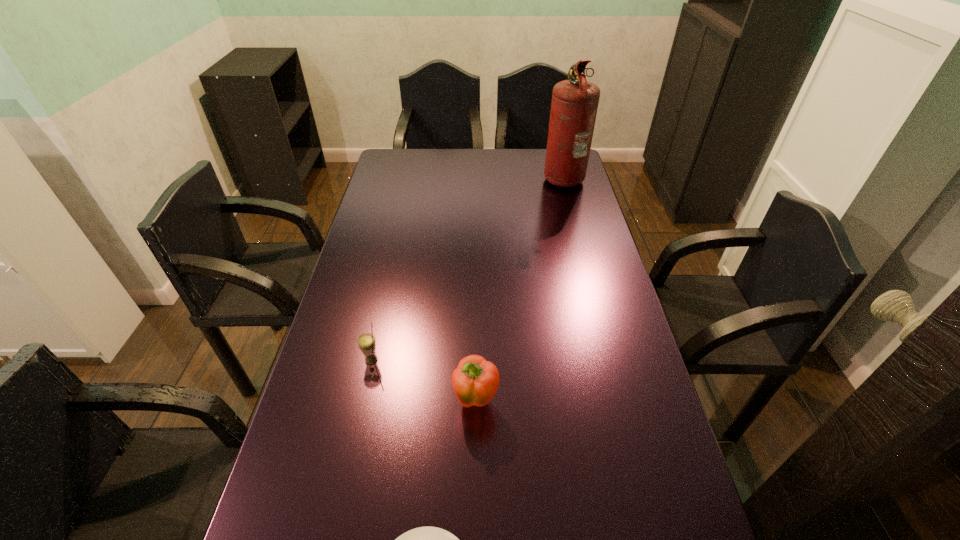
I want to click on free space located 0.310m on the right of the third tallest object, so click(501, 360).

Where is `object present at the far edge`? This screenshot has width=960, height=540. object present at the far edge is located at coordinates (574, 105).

At what (x,y) coordinates should I click in order to perform the action: click on object that is at the left edge. Please return your answer as a coordinate pair (x, y). Looking at the image, I should click on (366, 342).

Locate an element on the screen. This screenshot has width=960, height=540. object located at the right edge is located at coordinates (574, 105).

The width and height of the screenshot is (960, 540). Find the location of `object present at the far right corner`. object present at the far right corner is located at coordinates (574, 105).

Find the location of a particular element. free space at the far edge is located at coordinates (437, 159).

The width and height of the screenshot is (960, 540). Identify the location of free space at the left edge. (310, 472).

Where is `free space at the right edge`? The image size is (960, 540). free space at the right edge is located at coordinates (611, 303).

Locate an element on the screen. This screenshot has width=960, height=540. unoccupied position between the straw for drinking and the second tallest object is located at coordinates (423, 381).

You are a GUI agent. You are given a task and a screenshot of the screen. Output one action in this format:
    pyautogui.click(x=<x>, y=<y>)
    Task: Click on the free space between the second tallest object and the leftmost object
    This screenshot has height=540, width=960.
    Given the screenshot: What is the action you would take?
    pyautogui.click(x=423, y=381)